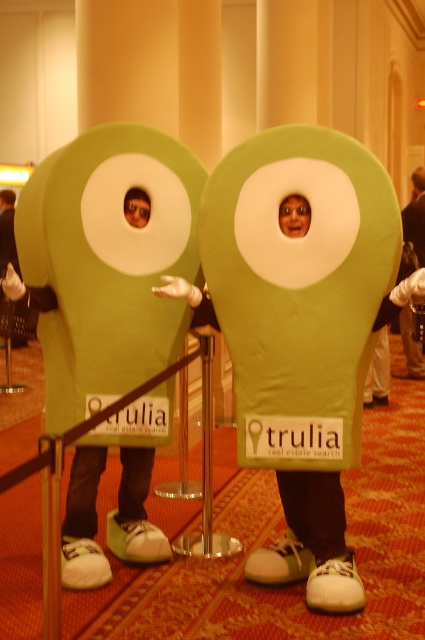
You are a photographer trying to capture a clear shot of the smooth matte face at center without including the green fabric costume at center. Based on their positions, is this possible?

The green fabric costume at center is above the smooth matte face at center, so it would block the view. Therefore, capturing a clear shot of the smooth matte face at center without the green fabric costume at center would not be possible.

In the scene shown: You are standing in a park and see a green fabric costume at center. Where would you look to find it?

The green fabric costume at center is located at the 2D coordinates point (416, 216).